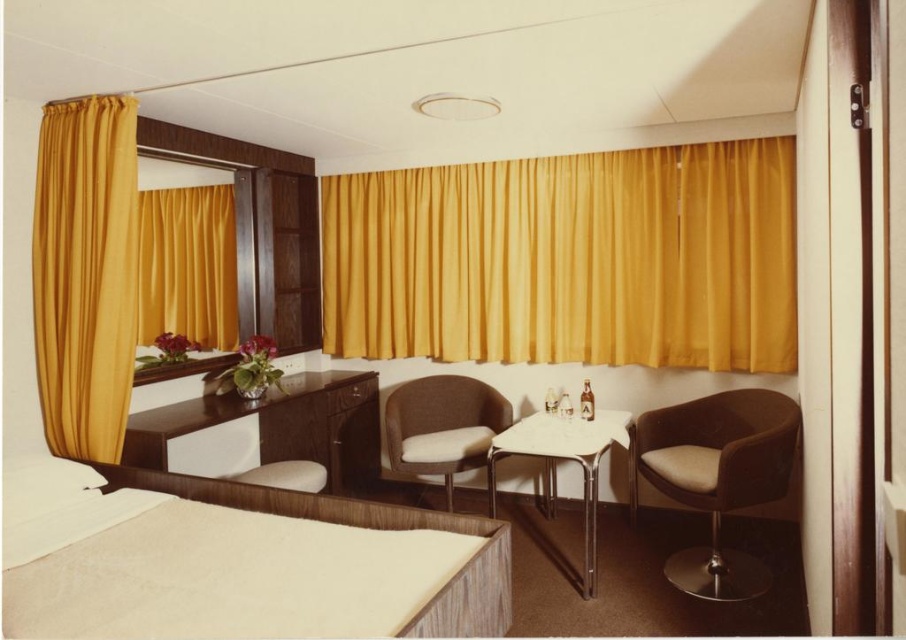
You are standing in the room and want to reach the point marked as point (85, 273). Which object in the room is this point located on?

The point (85, 273) is located on the matte gold curtain at left.